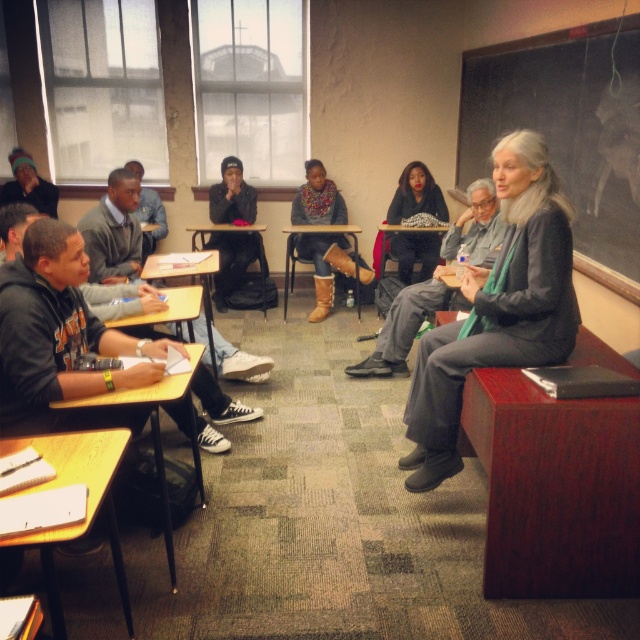
Question: Does mahogany wood table at right have a larger size compared to gray woolen scarf at upper right?

Choices:
 (A) no
 (B) yes

Answer: (A)

Question: Considering the real-world distances, which object is closest to the black leather jacket at center?

Choices:
 (A) mahogany wood table at right
 (B) brown wood table at center

Answer: (B)

Question: Which of the following is the closest to the observer?

Choices:
 (A) (163, 394)
 (B) (284, 230)
 (C) (548, 216)
 (D) (598, 156)

Answer: (A)

Question: Does yellow wood desk at lower left have a lesser width compared to black leather jacket at center?

Choices:
 (A) yes
 (B) no

Answer: (A)

Question: Among these objects, which one is nearest to the camera?

Choices:
 (A) wooden desk at lower left
 (B) black leather jacket at center
 (C) blackboard at upper right
 (D) brown wood table at center

Answer: (A)

Question: Is blackboard at upper right thinner than yellow wood desk at lower left?

Choices:
 (A) no
 (B) yes

Answer: (B)